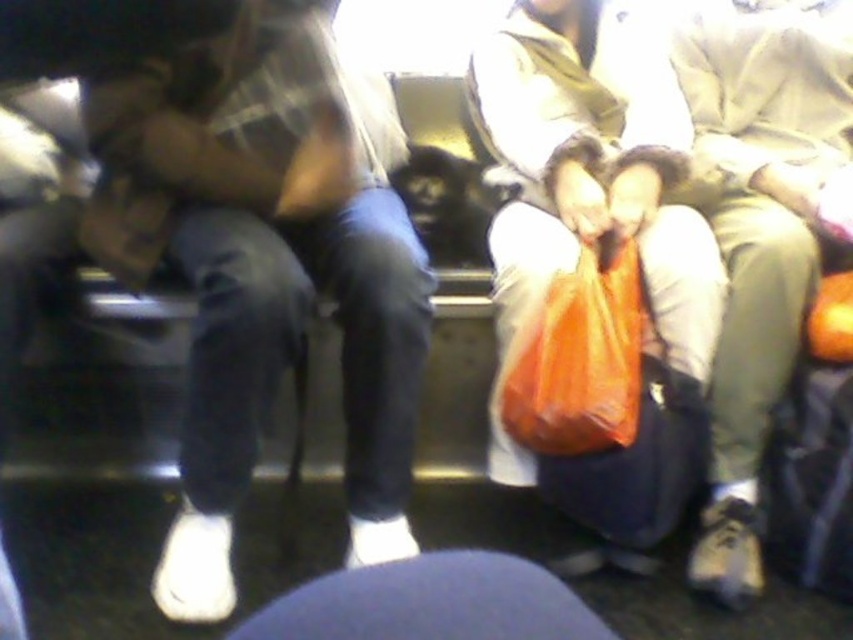
Question: Which point is closer to the camera?

Choices:
 (A) (672, 464)
 (B) (560, 428)
 (C) (821, 417)
 (D) (248, 328)

Answer: (D)

Question: Estimate the real-world distances between objects in this image. Which object is closer to the denim pants at left?

Choices:
 (A) orange plastic bag at center
 (B) matte black suitcase at lower right
 (C) blue fabric at lower center
 (D) orange fabric bag at center

Answer: (A)

Question: Does blue fabric at lower center appear on the left side of orange fabric bag at center?

Choices:
 (A) yes
 (B) no

Answer: (A)

Question: Does denim pants at left have a smaller size compared to orange fabric bag at center?

Choices:
 (A) no
 (B) yes

Answer: (A)

Question: Which object is farther from the camera taking this photo?

Choices:
 (A) denim pants at left
 (B) blue fabric at lower center
 (C) orange fabric bag at center
 (D) matte black suitcase at lower right

Answer: (C)

Question: Where is denim pants at left located in relation to orange plastic bag at center in the image?

Choices:
 (A) left
 (B) right

Answer: (A)